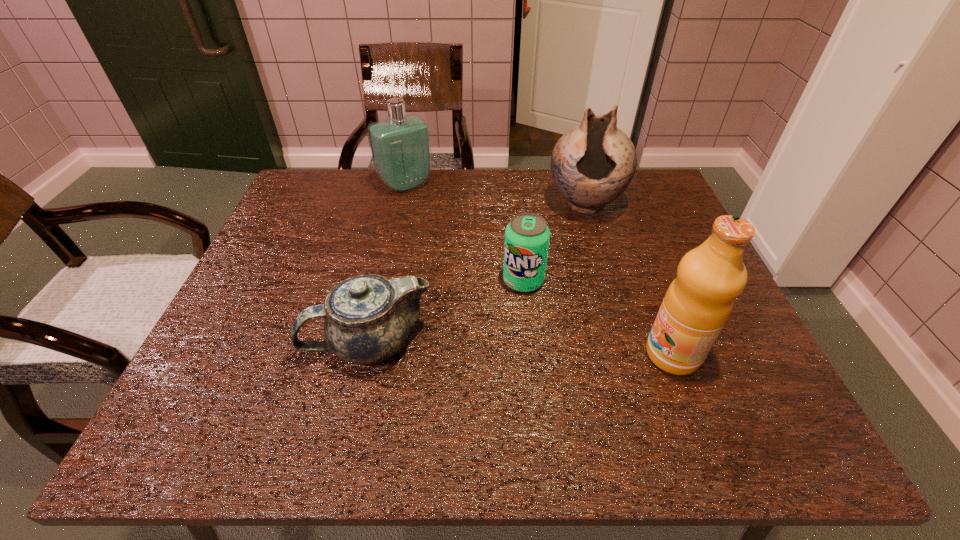
Where is `free space located 0.310m on the front label of the fruit juice`? This screenshot has width=960, height=540. free space located 0.310m on the front label of the fruit juice is located at coordinates (493, 354).

Identify the location of vacant space located 0.100m on the front label of the fruit juice. This screenshot has width=960, height=540. pos(596,354).

Locate an element on the screen. This screenshot has width=960, height=540. blank space located 0.360m from the spout of the pottery is located at coordinates (566, 327).

In order to click on free space located 0.200m from the spout of the pottery in this screenshot , I will do `click(574, 277)`.

You are a GUI agent. You are given a task and a screenshot of the screen. Output one action in this format:
    pyautogui.click(x=<x>, y=<y>)
    Task: Click on the vacant area situated from the spout of the pottery
    The height and width of the screenshot is (540, 960).
    Given the screenshot: What is the action you would take?
    pyautogui.click(x=579, y=244)

The width and height of the screenshot is (960, 540). Find the location of `vacant region located on the front-facing side of the third object from right to left`. vacant region located on the front-facing side of the third object from right to left is located at coordinates (504, 397).

The width and height of the screenshot is (960, 540). Find the location of `vacant space positioned 0.270m on the front-facing side of the third object from right to left`. vacant space positioned 0.270m on the front-facing side of the third object from right to left is located at coordinates (504, 397).

The height and width of the screenshot is (540, 960). I want to click on vacant space located on the front-facing side of the third object from right to left, so click(x=514, y=339).

Locate an element on the screen. The image size is (960, 540). vacant space located on the front label of the perfume is located at coordinates (440, 221).

The height and width of the screenshot is (540, 960). I want to click on vacant region located 0.400m on the front label of the perfume, so click(x=488, y=278).